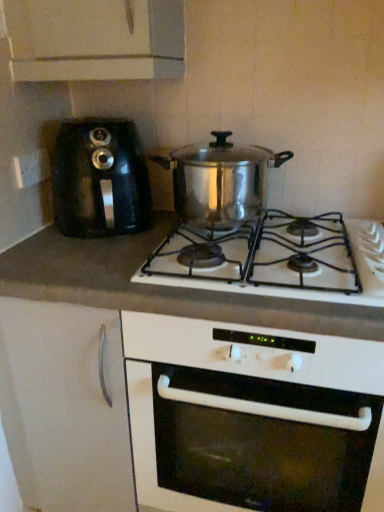
Question: Should I look upward or downward to see black plastic coffee machine at left?

Choices:
 (A) down
 (B) up

Answer: (B)

Question: Does black plastic coffee machine at left have a lesser width compared to white matte gas stove at center?

Choices:
 (A) yes
 (B) no

Answer: (A)

Question: Is white matte gas stove at center located within black plastic coffee machine at left?

Choices:
 (A) yes
 (B) no

Answer: (B)

Question: Can you confirm if black plastic coffee machine at left is positioned to the right of white matte gas stove at center?

Choices:
 (A) no
 (B) yes

Answer: (A)

Question: Does black plastic coffee machine at left come behind white matte gas stove at center?

Choices:
 (A) no
 (B) yes

Answer: (B)

Question: Does black plastic coffee machine at left have a lesser height compared to white matte gas stove at center?

Choices:
 (A) yes
 (B) no

Answer: (A)

Question: Is black plastic coffee machine at left bigger than white matte gas stove at center?

Choices:
 (A) yes
 (B) no

Answer: (B)

Question: Is white matte gas stove at center shorter than white plastic socket at left?

Choices:
 (A) yes
 (B) no

Answer: (B)

Question: Considering the relative sizes of white matte gas stove at center and white plastic socket at left in the image provided, is white matte gas stove at center wider than white plastic socket at left?

Choices:
 (A) no
 (B) yes

Answer: (B)

Question: From a real-world perspective, is white matte gas stove at center below white plastic socket at left?

Choices:
 (A) no
 (B) yes

Answer: (B)

Question: Does white matte gas stove at center appear on the left side of white plastic socket at left?

Choices:
 (A) no
 (B) yes

Answer: (A)

Question: Does white matte gas stove at center have a greater height compared to white plastic socket at left?

Choices:
 (A) yes
 (B) no

Answer: (A)

Question: Is white matte gas stove at center positioned in front of white plastic socket at left?

Choices:
 (A) yes
 (B) no

Answer: (A)

Question: Is white matte cabinet at lower left to the left of white plastic socket at left from the viewer's perspective?

Choices:
 (A) yes
 (B) no

Answer: (B)